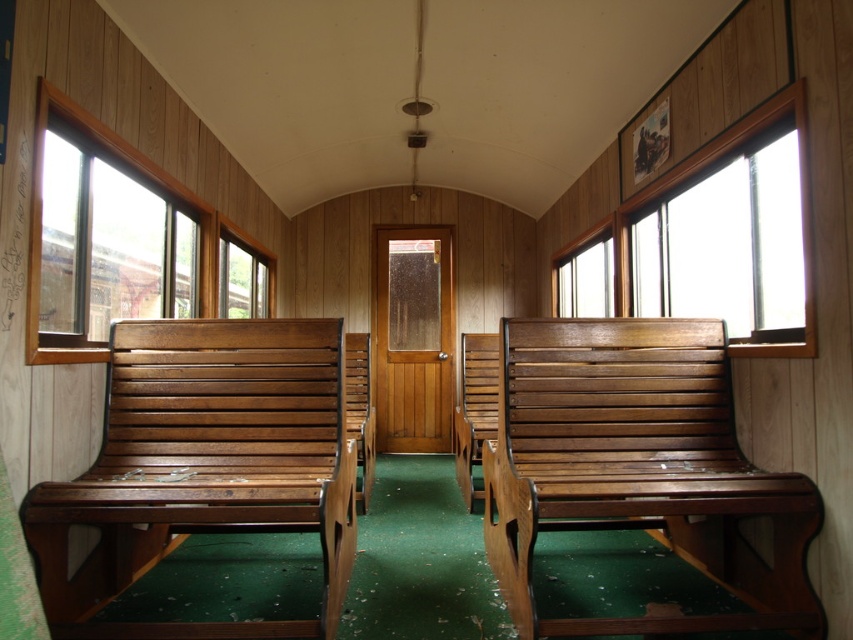
You are a passenger sitting in the vintage train car and want to enjoy the view outside. Which of the two clear glass windows, the clear glass window at left or the clear glass window at center right, offers a wider field of view?

The clear glass window at left has a larger size compared to the clear glass window at center right, so it offers a wider field of view.

You are a passenger sitting in the vintage train car and want to look outside through the windows. Which window, the clear glass window at upper right or the clear glass window at center, is closer to you?

The clear glass window at upper right is closer to the viewer than the clear glass window at center, so you can reach it more easily.

You are a passenger sitting in the vintage train car and want to enjoy the view outside. Which of the two windows, the clear glass window at left or the clear glass window at center right, would allow you to see a wider portion of the scenery?

The clear glass window at left has a larger width than the clear glass window at center right, so it allows you to see a wider portion of the scenery.